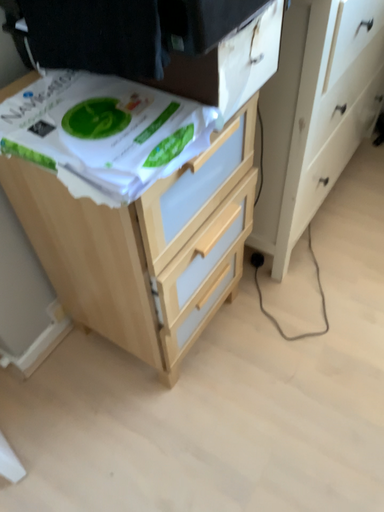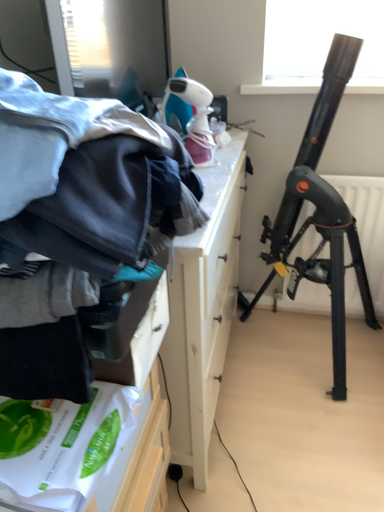
Question: Which way did the camera rotate in the video?

Choices:
 (A) rotated upward
 (B) rotated downward

Answer: (A)